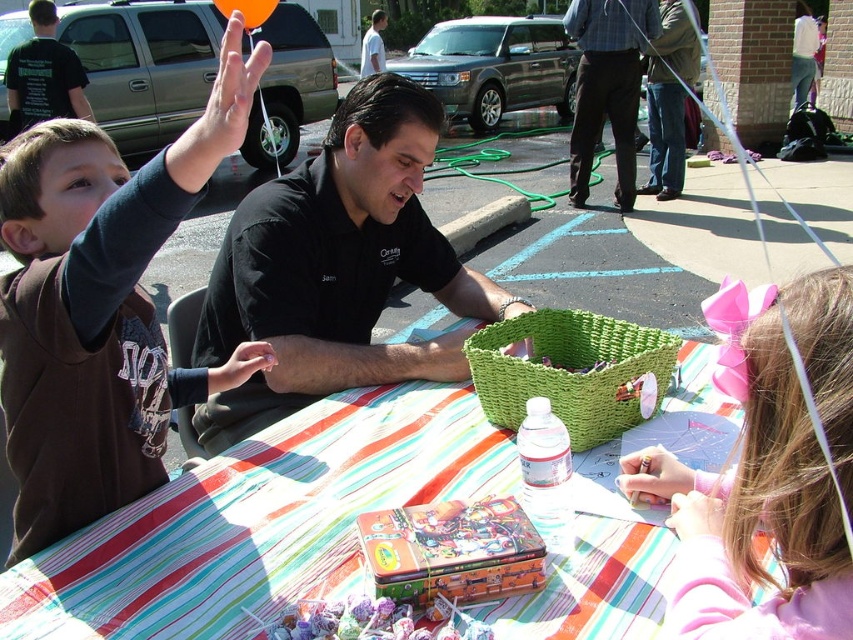
Question: Does striped fabric table at center have a larger size compared to brown fleece jacket at left?

Choices:
 (A) yes
 (B) no

Answer: (B)

Question: Which point is farther to the camera?

Choices:
 (A) orange matte balloon at upper center
 (B) brown fleece jacket at left
 (C) striped fabric table at center

Answer: (A)

Question: Is black shirt at center positioned behind black shirt at left?

Choices:
 (A) no
 (B) yes

Answer: (A)

Question: Can you confirm if black shirt at center is positioned below orange matte balloon at upper center?

Choices:
 (A) yes
 (B) no

Answer: (A)

Question: Which of the following is the farthest from the observer?

Choices:
 (A) (416, 433)
 (B) (589, 113)
 (C) (59, 52)

Answer: (B)

Question: Among these objects, which one is nearest to the camera?

Choices:
 (A) striped fabric table at center
 (B) brown cotton pants at center
 (C) black shirt at center

Answer: (A)